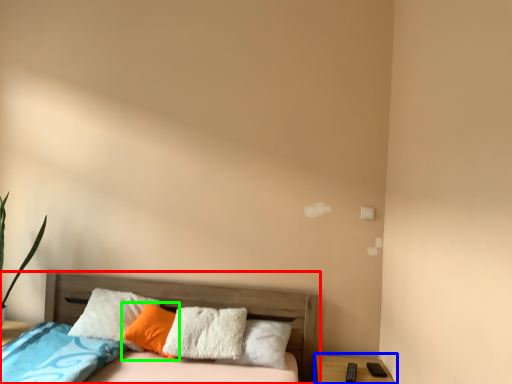
Question: Which is farther away from bed (highlighted by a red box)? nightstand (highlighted by a blue box) or pillow (highlighted by a green box)?

Choices:
 (A) nightstand
 (B) pillow

Answer: (A)